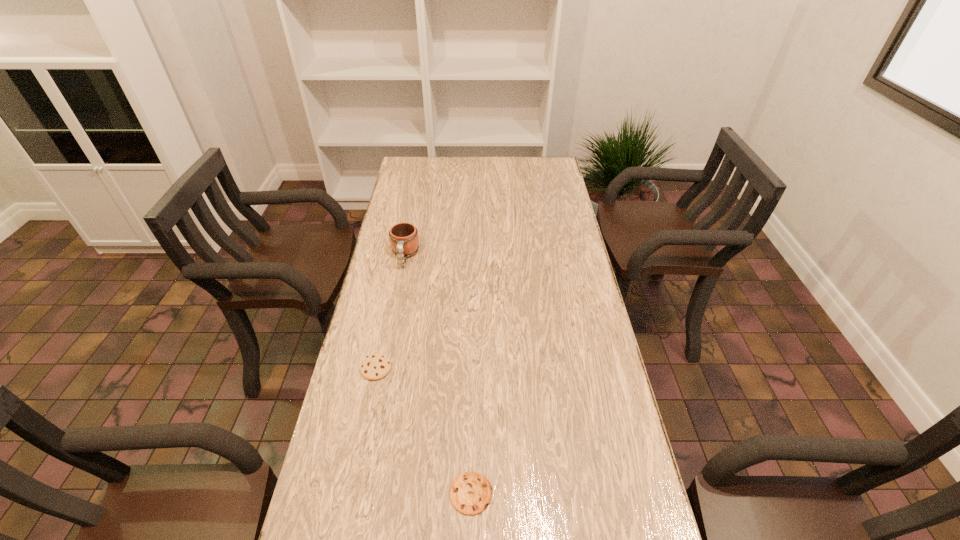
At what (x,y) coordinates should I click in order to perform the action: click on free point between the tallest object and the nearest object. Please return your answer as a coordinate pair (x, y). The width and height of the screenshot is (960, 540). Looking at the image, I should click on (x=438, y=375).

You are a GUI agent. You are given a task and a screenshot of the screen. Output one action in this format:
    pyautogui.click(x=<x>, y=<y>)
    Task: Click on the vacant space in between the left cookie and the farthest object
    The width and height of the screenshot is (960, 540).
    Given the screenshot: What is the action you would take?
    pyautogui.click(x=391, y=312)

Where is `empty location between the nearest object and the taller cookie`? Image resolution: width=960 pixels, height=540 pixels. empty location between the nearest object and the taller cookie is located at coordinates (423, 431).

Locate an element on the screen. The height and width of the screenshot is (540, 960). free space between the left cookie and the right cookie is located at coordinates (423, 431).

Identify the location of free spot between the shortest object and the mug. (438, 375).

Locate which object is the closest to the tallest object. Please provide its 2D coordinates. Your answer should be formatted as a tuple, i.e. [(x, y)], where the tuple contains the x and y coordinates of a point satisfying the conditions above.

[(376, 366)]

Locate which object is the closest to the tallest object. Please provide its 2D coordinates. Your answer should be formatted as a tuple, i.e. [(x, y)], where the tuple contains the x and y coordinates of a point satisfying the conditions above.

[(376, 366)]

Find the location of `free space in the image that satisfies the following two spatial constraints: 1. on the side of the right cookie with the handle; 2. on the left side of the tallest object`. free space in the image that satisfies the following two spatial constraints: 1. on the side of the right cookie with the handle; 2. on the left side of the tallest object is located at coordinates (359, 493).

At what (x,y) coordinates should I click in order to perform the action: click on free point that satisfies the following two spatial constraints: 1. on the side of the shortest object with the handle; 2. on the left side of the farthest object. Please return your answer as a coordinate pair (x, y). Looking at the image, I should click on (359, 493).

This screenshot has width=960, height=540. Identify the location of vacant area that satisfies the following two spatial constraints: 1. on the front side of the shorter cookie; 2. on the right side of the farther cookie. (350, 493).